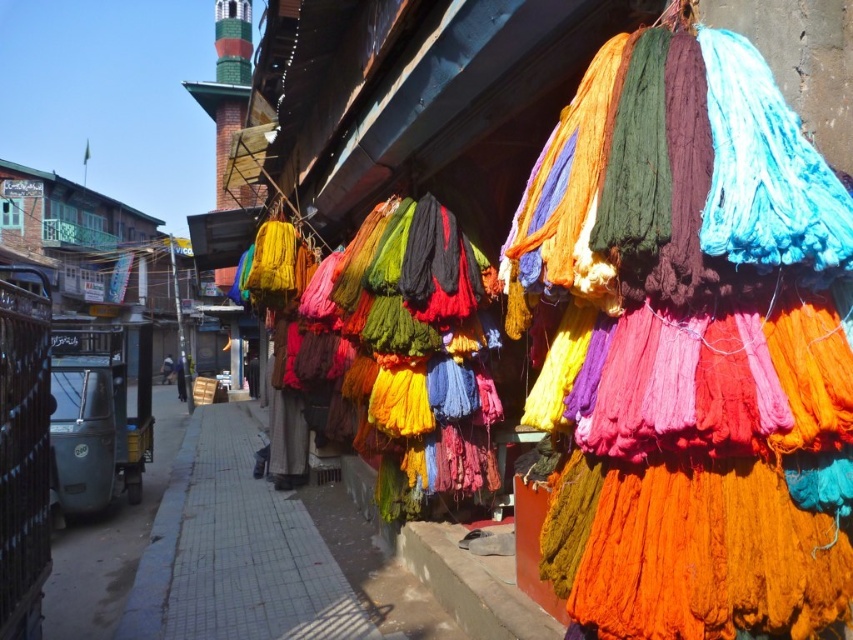
Between bright multicolored yarn at right and gray concrete pavement at lower left, which one is positioned lower?

gray concrete pavement at lower left is below.

Which is behind, point (799, 129) or point (107, 577)?

Point (107, 577)

Measure the distance between point (804, 579) and camera.

Point (804, 579) is 1.64 meters from camera.

Locate an element on the screen. The image size is (853, 640). bright multicolored yarn at right is located at coordinates (618, 307).

Measure the distance from bright multicolored yarn at right to gray tile pavement at center.

bright multicolored yarn at right and gray tile pavement at center are 2.51 meters apart from each other.

Can you confirm if bright multicolored yarn at right is thinner than gray tile pavement at center?

Indeed, bright multicolored yarn at right has a lesser width compared to gray tile pavement at center.

The image size is (853, 640). What do you see at coordinates (618, 307) in the screenshot?
I see `bright multicolored yarn at right` at bounding box center [618, 307].

Where is `bright multicolored yarn at right`? bright multicolored yarn at right is located at coordinates (618, 307).

Is gray tile pavement at center above gray concrete pavement at lower left?

Indeed, gray tile pavement at center is positioned over gray concrete pavement at lower left.

Does gray tile pavement at center come in front of gray concrete pavement at lower left?

Yes, gray tile pavement at center is closer to the viewer.

Is point (303, 506) closer to camera compared to point (160, 500)?

Yes.

This screenshot has width=853, height=640. Find the location of `gray tile pavement at center`. gray tile pavement at center is located at coordinates (235, 552).